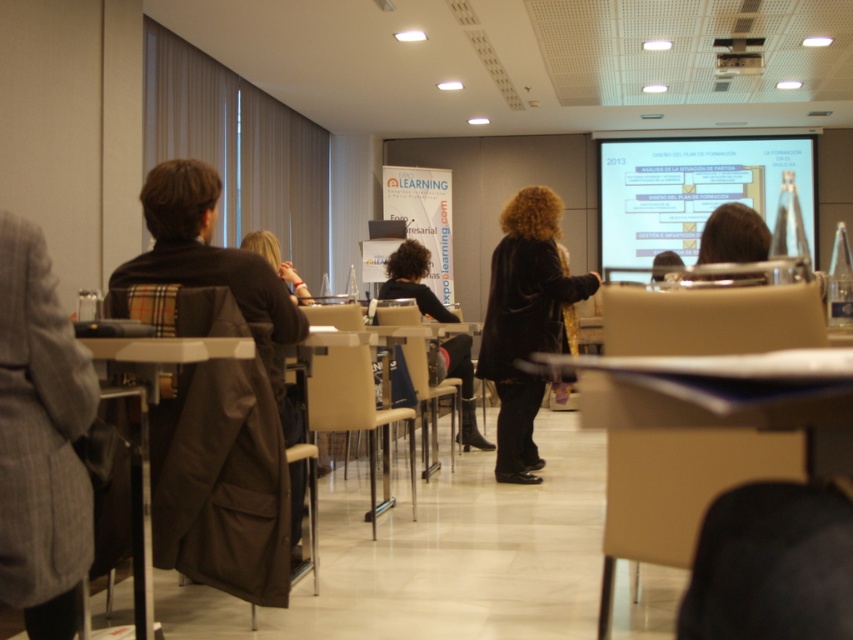
You are attending a presentation at the EXPO eLEARNING event. You need to place a laptop on the wooden table at center and ensure it doesn not block the view of the white glossy projection screen at upper center. Can you do this?

The wooden table at center is below the white glossy projection screen at upper center, so placing the laptop on the wooden table at center will not block the view of the screen as they are positioned vertically apart.

Consider the image. You are a photographer positioned at the camera. You want to capture a closeup of the velvet black coat at center without moving the coat. Can you move closer to the coat to achieve this?

The velvet black coat at center is 4.45 meters from camera. To capture a closeup, you would need to move closer to reduce the distance. Since the coat cannot be moved, moving closer to within 4.45 meters would allow you to get a closer shot.

You are standing at the front of the room and want to check if you can reach the white glossy projection screen at upper center with a 10 meter long extension cord. Can you safely plug in the cord to the screen without it being too short?

The white glossy projection screen at upper center is 9.95 meters away from the viewer. Since the extension cord is 10 meters long, it is just long enough to reach the screen. However, it is recommended to have some extra length for safety, so the cord might be slightly too short depending on the exact placement and any bends or curves in the path.